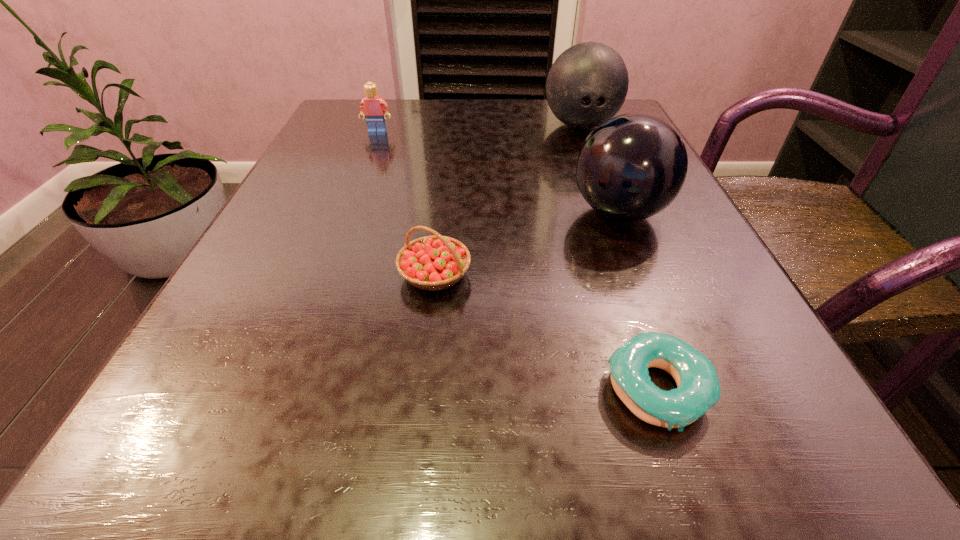
You are a GUI agent. You are given a task and a screenshot of the screen. Output one action in this format:
    pyautogui.click(x=<x>, y=<y>)
    Task: Click on the unoccupied position between the nearest object and the leftmost object
    
    Given the screenshot: What is the action you would take?
    pyautogui.click(x=517, y=261)

Identify the location of blank region between the shortest object and the nearer bowling ball. (638, 301).

This screenshot has height=540, width=960. What are the coordinates of `blank region between the third shortest object and the third nearest object` in the screenshot? It's located at (498, 173).

Locate an element on the screen. This screenshot has width=960, height=540. vacant point located between the leftmost object and the farther bowling ball is located at coordinates (479, 129).

You are a GUI agent. You are given a task and a screenshot of the screen. Output one action in this format:
    pyautogui.click(x=<x>, y=<y>)
    Task: Click on the vacant space that is in between the third farthest object and the leftmost object
    The image size is (960, 540).
    Given the screenshot: What is the action you would take?
    pyautogui.click(x=498, y=173)

Where is `free area in between the nearer bowling ball and the nearest object`? This screenshot has height=540, width=960. free area in between the nearer bowling ball and the nearest object is located at coordinates (638, 301).

Image resolution: width=960 pixels, height=540 pixels. In order to click on the second closest object relative to the third tallest object in this screenshot , I will do `click(436, 262)`.

Locate an element on the screen. This screenshot has width=960, height=540. object that is the second closest one to the fourth object from right to left is located at coordinates (698, 389).